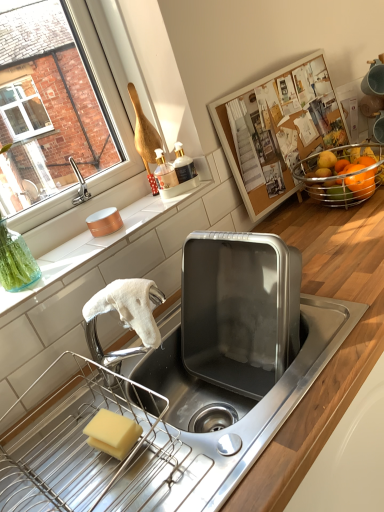
Question: Is shiny orange fruit at upper right wider or thinner than yellow sponge at lower left?

Choices:
 (A) thin
 (B) wide

Answer: (B)

Question: Is shiny orange fruit at upper right in front of or behind yellow sponge at lower left in the image?

Choices:
 (A) front
 (B) behind

Answer: (B)

Question: Estimate the real-world distances between objects in this image. Which object is farther from the shiny orange fruit at upper right?

Choices:
 (A) wooden at lower right, the 2th countertop positioned from the top
 (B) yellow sponge at lower left
 (C) orange matte at right
 (D) white matte towel at left, which is the 1th countertop in top-to-bottom order

Answer: (B)

Question: Which of these objects is positioned farthest from the shiny orange fruit at upper right?

Choices:
 (A) yellow sponge at lower left
 (B) white matte towel at left, which is the 1th countertop in top-to-bottom order
 (C) wooden at lower right, the 1th countertop positioned from the bottom
 (D) orange matte at right

Answer: (A)